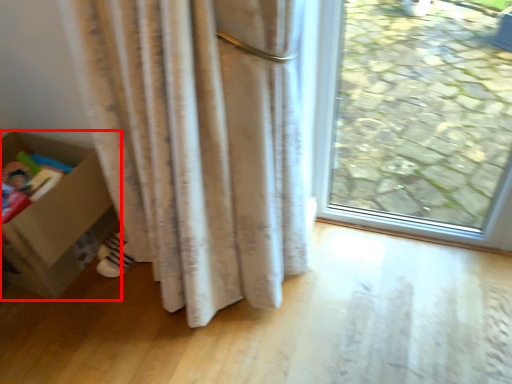
Question: Observing the image, what is the correct spatial positioning of box (annotated by the red box) in reference to footwear?

Choices:
 (A) right
 (B) left

Answer: (B)